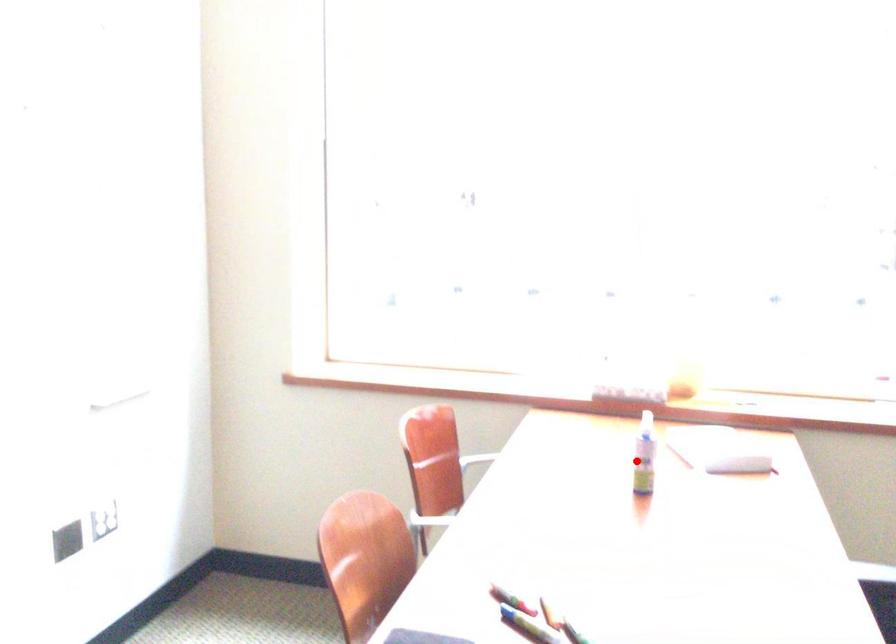
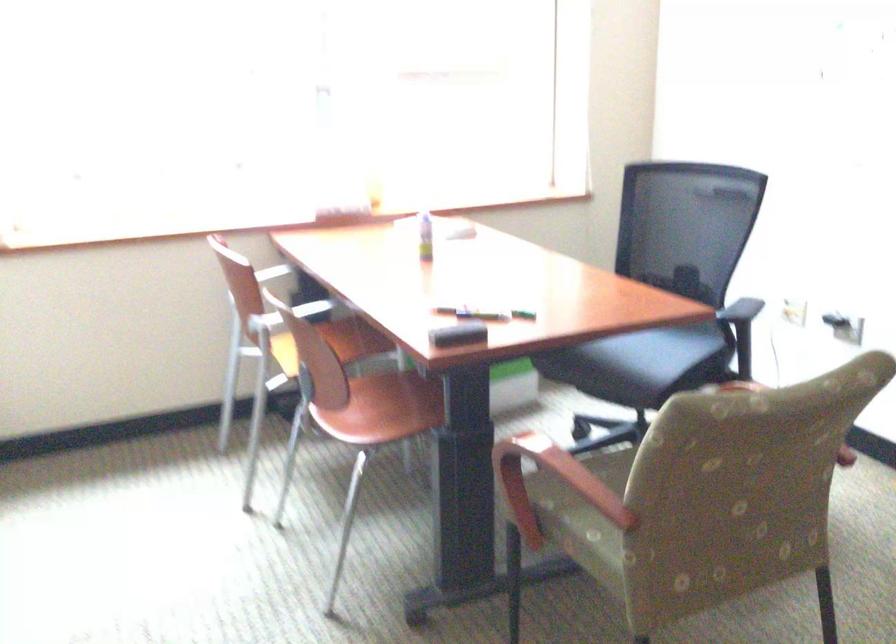
Question: I am providing you with two images of the same scene from different viewpoints. Given a red point in image1, look at the same physical point in image2. Is it:

Choices:
 (A) Closer to the viewpoint
 (B) Farther from the viewpoint

Answer: (B)